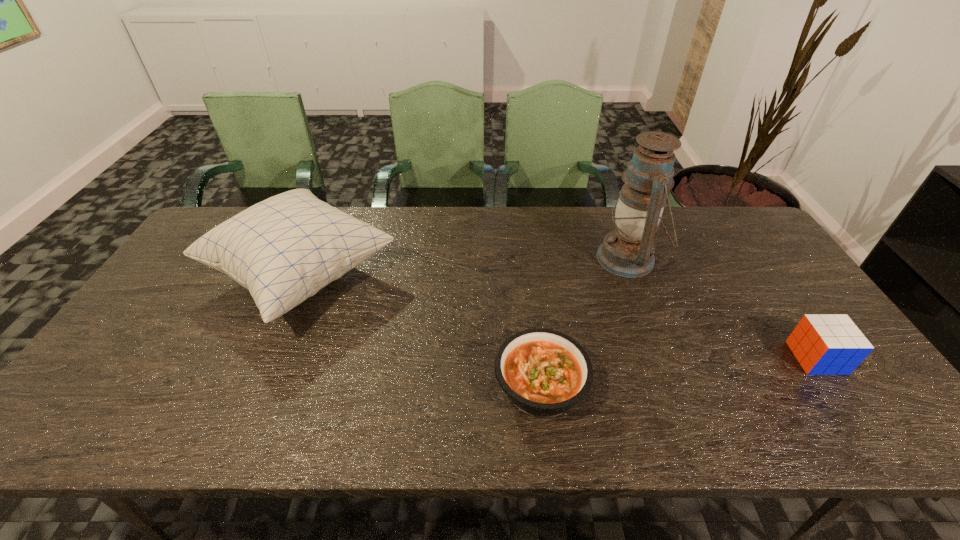
Identify the location of the tallest object. The height and width of the screenshot is (540, 960). (628, 251).

This screenshot has height=540, width=960. I want to click on the third object from left to right, so click(628, 251).

Image resolution: width=960 pixels, height=540 pixels. What are the coordinates of `cushion` in the screenshot? It's located at (284, 249).

You are a GUI agent. You are given a task and a screenshot of the screen. Output one action in this format:
    pyautogui.click(x=<x>, y=<y>)
    Task: Click on the second tallest object
    This screenshot has width=960, height=540.
    Given the screenshot: What is the action you would take?
    pyautogui.click(x=284, y=249)

You are a GUI agent. You are given a task and a screenshot of the screen. Output one action in this format:
    pyautogui.click(x=<x>, y=<y>)
    Task: Click on the second shortest object
    This screenshot has height=540, width=960.
    Given the screenshot: What is the action you would take?
    pyautogui.click(x=826, y=344)

Identify the location of cube. (826, 344).

You are a GUI agent. You are given a task and a screenshot of the screen. Output one action in this format:
    pyautogui.click(x=<x>, y=<y>)
    Task: Click on the shortest object
    
    Given the screenshot: What is the action you would take?
    pyautogui.click(x=544, y=372)

The height and width of the screenshot is (540, 960). What are the coordinates of `stew` in the screenshot? It's located at (544, 372).

Identify the location of vacant space located on the left of the tallest object. This screenshot has height=540, width=960. 485,259.

Where is `free region located 0.220m on the front of the leftmost object`? The image size is (960, 540). free region located 0.220m on the front of the leftmost object is located at coordinates (232, 435).